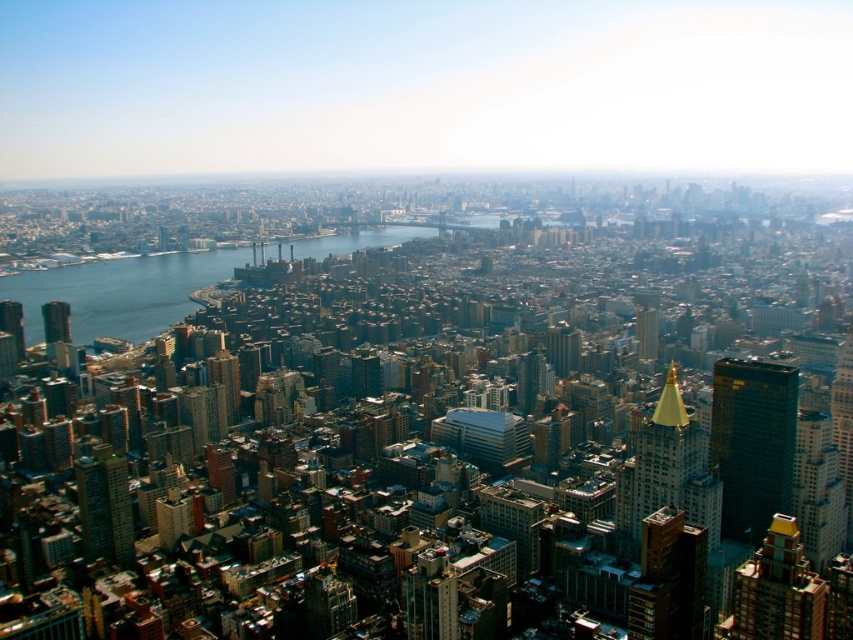
You are a drone operator trying to capture a clear photo of the shiny gold skyscraper at upper right and the matte black skyscraper at left. From your current position, which skyscraper will appear larger in the photo?

The shiny gold skyscraper at upper right will appear larger because it is closer to you than the matte black skyscraper at left, which is further away.

You are a drone operator tasked with flying a drone from the shiny gold skyscraper at upper right to the matte black skyscraper at left. Based on the scene description, which direction should you fly the drone to reach the destination?

The shiny gold skyscraper at upper right is positioned under the matte black skyscraper at left, so you should fly the drone upward to reach the matte black skyscraper at left.

You are a drone operator trying to capture a photo of the city from above. Your drone has a maximum flight range of 2500 feet. If you are currently at the camera position, can your drone reach the point at coordinates point (27,342) without exceeding its range?

The distance between point (27,342) and the camera is 2406.79 feet, which is within the drone operator s 2500 feet maximum flight range. Therefore, the drone can reach point (27,342) without exceeding its range.